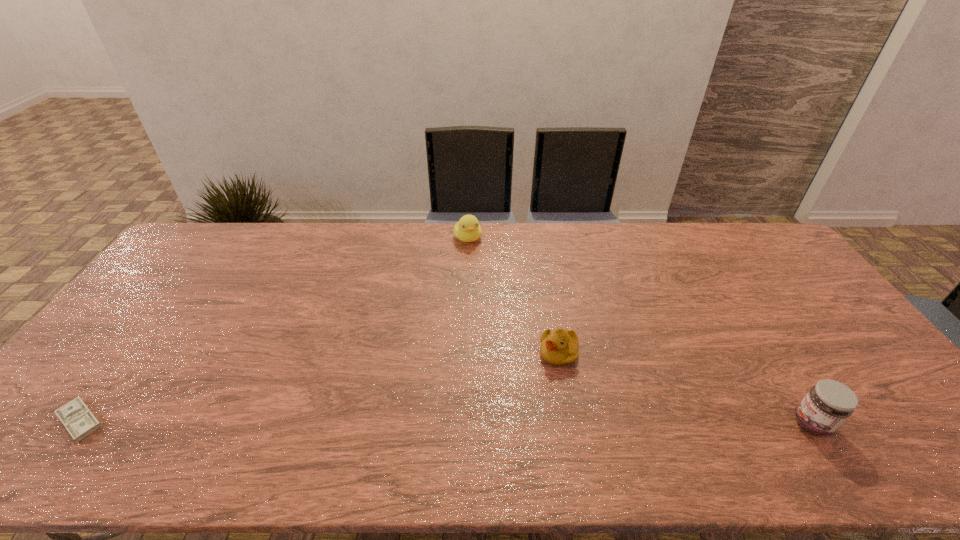
At what (x,y) coordinates should I click in order to perform the action: click on vacant space located 0.330m on the front label of the jam. Please return your answer as a coordinate pair (x, y). Looking at the image, I should click on (654, 423).

The height and width of the screenshot is (540, 960). I want to click on vacant area situated on the front-facing side of the nearer duckling, so click(x=489, y=427).

Where is `vacant area situated on the front-facing side of the nearer duckling`? Image resolution: width=960 pixels, height=540 pixels. vacant area situated on the front-facing side of the nearer duckling is located at coordinates (527, 387).

What are the coordinates of `free region located 0.140m on the front-facing side of the nearer duckling` in the screenshot? It's located at (515, 400).

The image size is (960, 540). I want to click on vacant space located 0.230m at the beak of the farthest object, so tap(489, 290).

Where is `free region located at the beak of the farthest object`? Image resolution: width=960 pixels, height=540 pixels. free region located at the beak of the farthest object is located at coordinates (477, 261).

You are a GUI agent. You are given a task and a screenshot of the screen. Output one action in this format:
    pyautogui.click(x=<x>, y=<y>)
    Task: Click on the vacant space situated at the beak of the farthest object
    The image size is (960, 540).
    Given the screenshot: What is the action you would take?
    pyautogui.click(x=492, y=296)

Image resolution: width=960 pixels, height=540 pixels. What are the coordinates of `object that is at the far edge` in the screenshot? It's located at (468, 229).

Identify the location of money that is positioned at the near edge. This screenshot has height=540, width=960. (80, 422).

At what (x,y) coordinates should I click in order to perform the action: click on jam at the near edge. Please return your answer as a coordinate pair (x, y). This screenshot has height=540, width=960. Looking at the image, I should click on (829, 403).